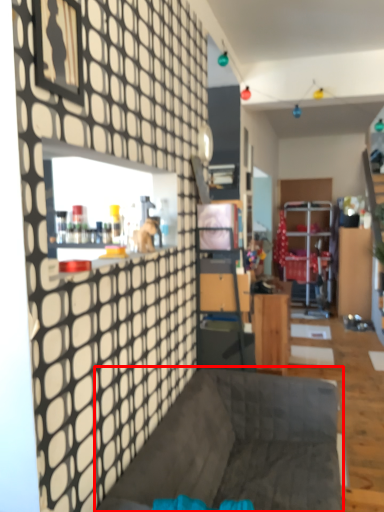
Question: From the image's perspective, what is the correct spatial positioning of furniture (annotated by the red box) in reference to table?

Choices:
 (A) above
 (B) below

Answer: (B)